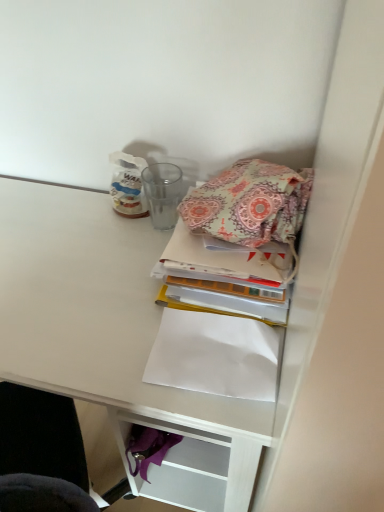
Image resolution: width=384 pixels, height=512 pixels. What are the coordinates of `free space to the left of paisley fabric book at center` in the screenshot? It's located at (95, 273).